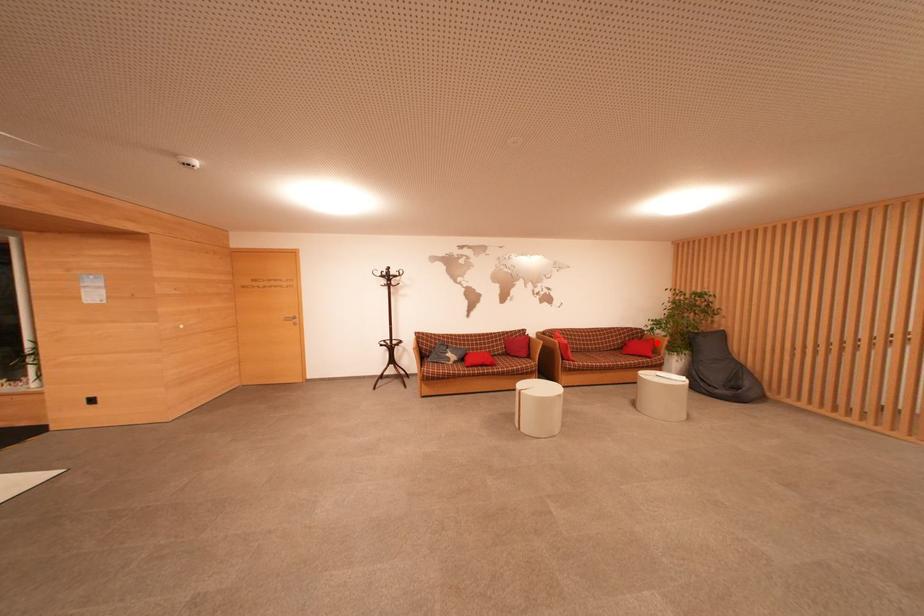
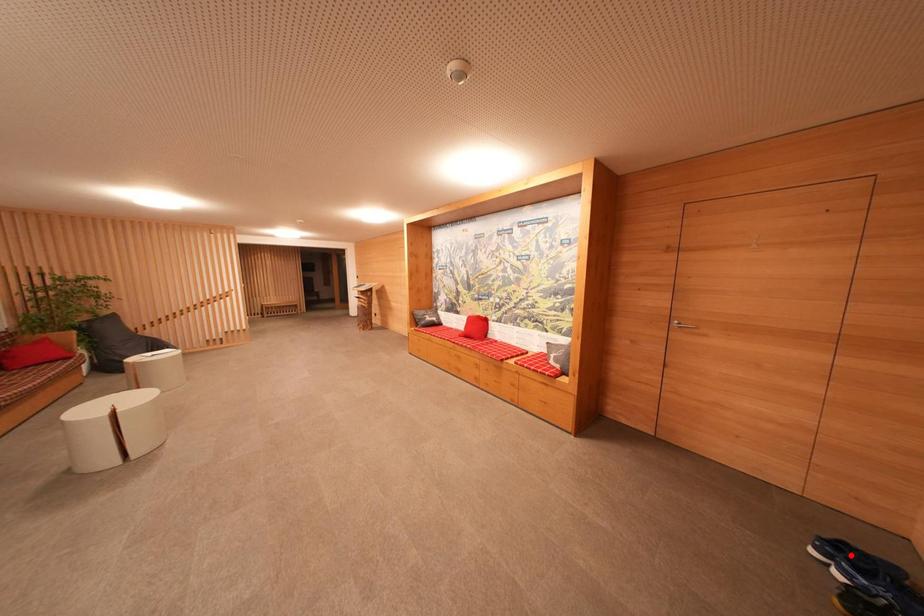
I am providing you with two images of the same scene from different viewpoints. A red point is marked on the first image and another point is marked on the second image. Does the point marked in image1 correspond to the same location as the one in image2?

No